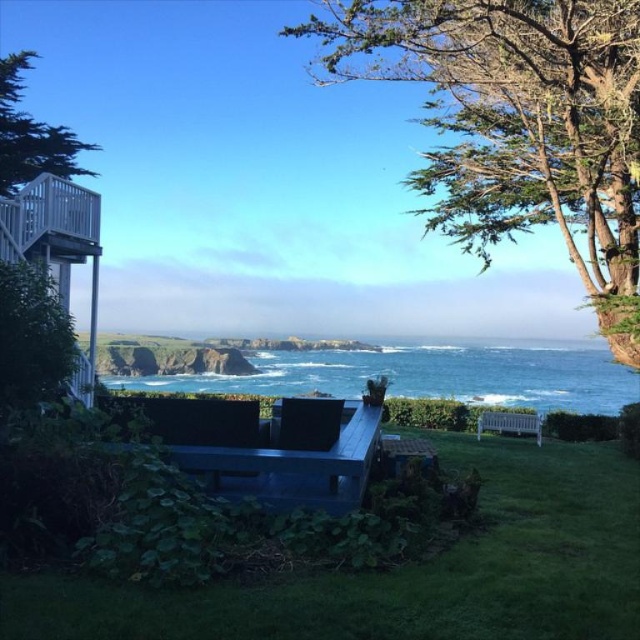
Which of these two, green textured tree at upper right or blue ocean water at center, stands taller?

Standing taller between the two is green textured tree at upper right.

Can you confirm if green textured tree at upper right is thinner than blue ocean water at center?

Indeed, green textured tree at upper right has a lesser width compared to blue ocean water at center.

What are the coordinates of `green textured tree at upper right` in the screenshot? It's located at (516, 124).

Can you confirm if green grass at lower center is thinner than blue ocean water at center?

Yes, green grass at lower center is thinner than blue ocean water at center.

Is green grass at lower center to the left of blue ocean water at center from the viewer's perspective?

In fact, green grass at lower center is to the right of blue ocean water at center.

Identify the location of green grass at lower center. This screenshot has width=640, height=640. (406, 572).

Consider the image. Does green textured tree at upper right have a lesser height compared to green textured tree at upper left?

No, green textured tree at upper right is not shorter than green textured tree at upper left.

Which of these two, green textured tree at upper right or green textured tree at upper left, stands shorter?

Standing shorter between the two is green textured tree at upper left.

Is point (413, 51) behind point (26, 177)?

No, (413, 51) is in front of (26, 177).

Image resolution: width=640 pixels, height=640 pixels. What are the coordinates of `green textured tree at upper right` in the screenshot? It's located at (516, 124).